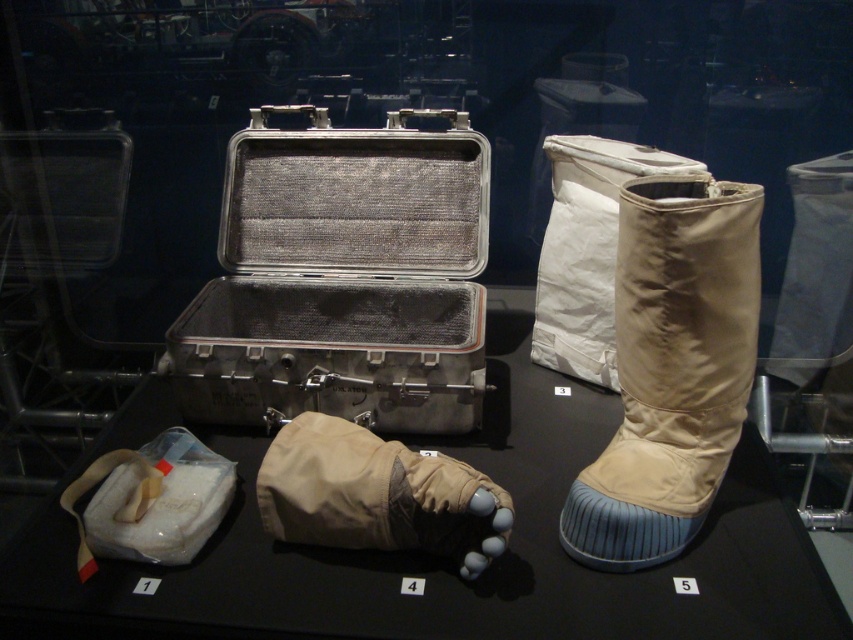
Is beige fabric glove at center positioned at the back of beige fabric boot at upper right?

No, beige fabric glove at center is closer to the viewer.

Can you confirm if beige fabric glove at center is shorter than beige fabric boot at upper right?

Indeed, beige fabric glove at center has a lesser height compared to beige fabric boot at upper right.

What do you see at coordinates (376, 496) in the screenshot? I see `beige fabric glove at center` at bounding box center [376, 496].

Image resolution: width=853 pixels, height=640 pixels. Find the location of `beige fabric glove at center`. beige fabric glove at center is located at coordinates (376, 496).

Is matte silver case at center further to camera compared to beige fabric boot at upper right?

No, it is in front of beige fabric boot at upper right.

Which is below, matte silver case at center or beige fabric boot at upper right?

matte silver case at center is below.

Between point (791, 611) and point (556, 220), which one is positioned behind?

Point (556, 220)

Where is `matte silver case at center`? This screenshot has width=853, height=640. matte silver case at center is located at coordinates (432, 557).

Is matte silver case at center to the left of white fabric bag at lower left from the viewer's perspective?

No, matte silver case at center is not to the left of white fabric bag at lower left.

Is matte silver case at center to the right of white fabric bag at lower left from the viewer's perspective?

Indeed, matte silver case at center is positioned on the right side of white fabric bag at lower left.

Find the location of a particular element. matte silver case at center is located at coordinates (432, 557).

You are a GUI agent. You are given a task and a screenshot of the screen. Output one action in this format:
    pyautogui.click(x=<x>, y=<y>)
    Task: Click on the matte silver case at center
    The width and height of the screenshot is (853, 640).
    Given the screenshot: What is the action you would take?
    pyautogui.click(x=432, y=557)